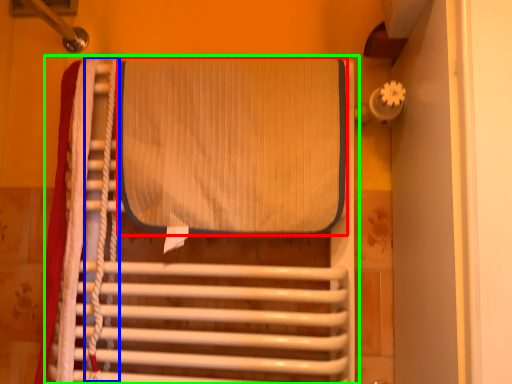
Question: Which is nearer to the wide (highlighted by a red box)? rope (highlighted by a blue box) or furniture (highlighted by a green box).

Choices:
 (A) rope
 (B) furniture

Answer: (B)